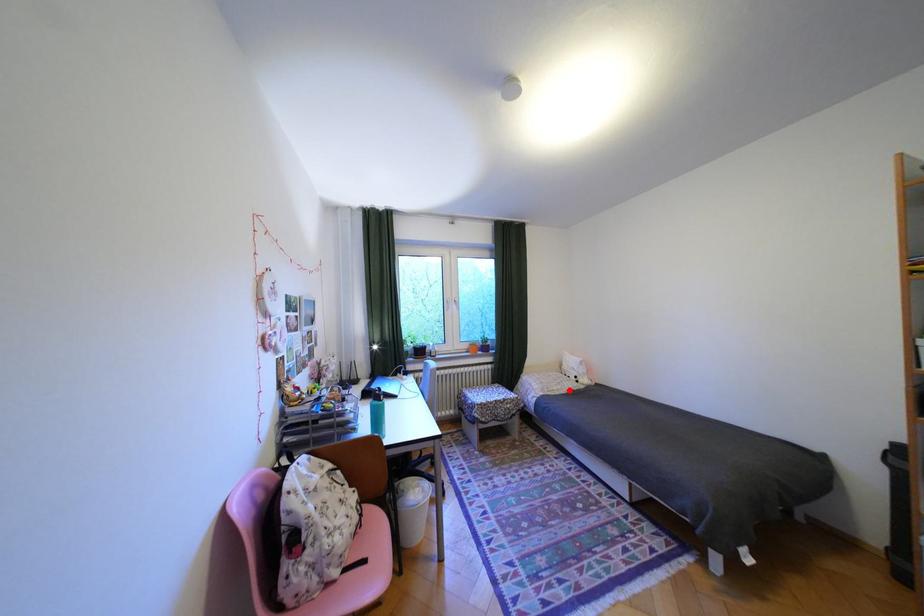
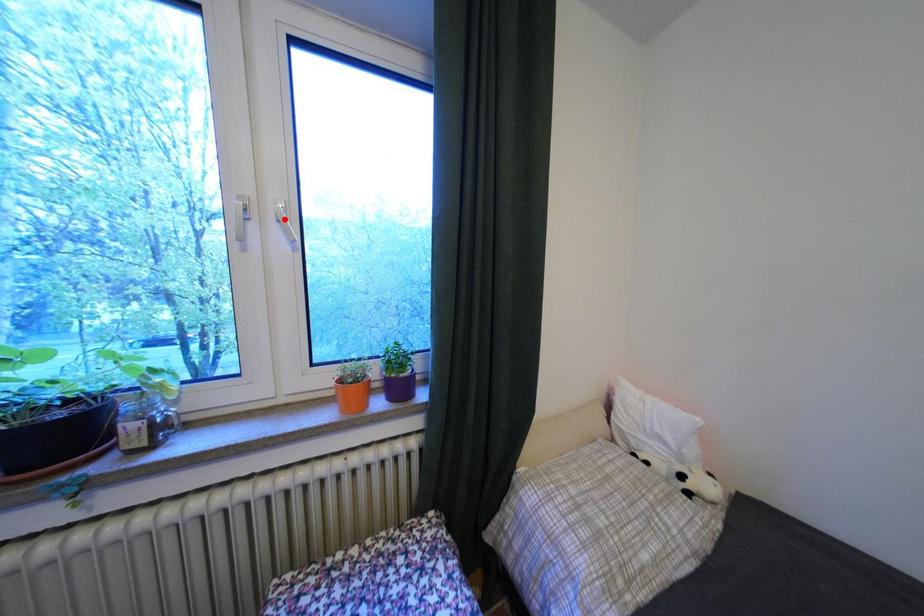
I am providing you with two images of the same scene from different viewpoints. A red point is marked on the first image and another point is marked on the second image. Is the marked point in image1 the same physical position as the marked point in image2?

No